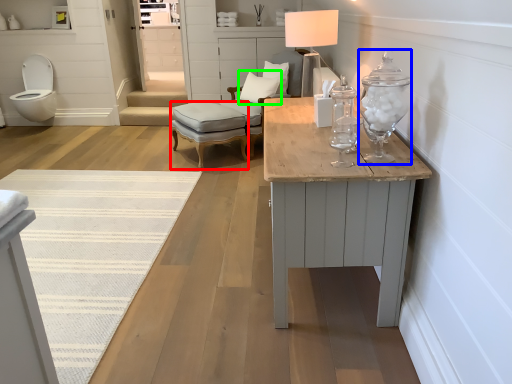
Question: Which object is the farthest from stool (highlighted by a red box)? Choose among these: candle holder (highlighted by a blue box) or pillow (highlighted by a green box).

Choices:
 (A) candle holder
 (B) pillow

Answer: (A)